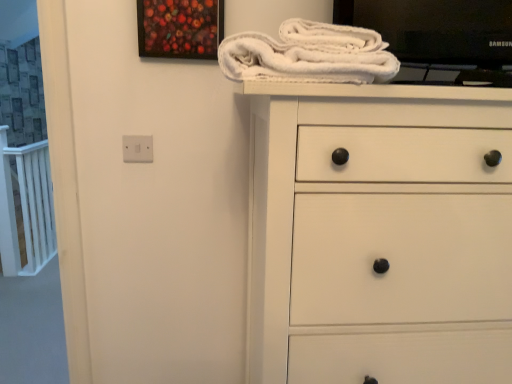
Question: Does white matte chest of drawers at center have a lesser width compared to painted wood picture frame at upper center?

Choices:
 (A) no
 (B) yes

Answer: (A)

Question: Is white matte chest of drawers at center wider than painted wood picture frame at upper center?

Choices:
 (A) no
 (B) yes

Answer: (B)

Question: Is white matte chest of drawers at center behind painted wood picture frame at upper center?

Choices:
 (A) yes
 (B) no

Answer: (B)

Question: Is white matte chest of drawers at center turned away from painted wood picture frame at upper center?

Choices:
 (A) no
 (B) yes

Answer: (A)

Question: Is white matte chest of drawers at center to the left of painted wood picture frame at upper center from the viewer's perspective?

Choices:
 (A) yes
 (B) no

Answer: (B)

Question: Is white matte chest of drawers at center taller or shorter than painted wood picture frame at upper center?

Choices:
 (A) short
 (B) tall

Answer: (B)

Question: In terms of size, does white matte chest of drawers at center appear bigger or smaller than painted wood picture frame at upper center?

Choices:
 (A) small
 (B) big

Answer: (B)

Question: From the image's perspective, is white matte chest of drawers at center above or below painted wood picture frame at upper center?

Choices:
 (A) above
 (B) below

Answer: (B)

Question: In the image, is white matte chest of drawers at center positioned in front of or behind painted wood picture frame at upper center?

Choices:
 (A) front
 (B) behind

Answer: (A)

Question: Is white matte chest of drawers at center situated inside white fluffy bath towel at upper center or outside?

Choices:
 (A) outside
 (B) inside

Answer: (A)

Question: From the image's perspective, is white matte chest of drawers at center located above or below white fluffy bath towel at upper center?

Choices:
 (A) above
 (B) below

Answer: (B)

Question: Considering the positions of white matte chest of drawers at center and white fluffy bath towel at upper center in the image, is white matte chest of drawers at center taller or shorter than white fluffy bath towel at upper center?

Choices:
 (A) short
 (B) tall

Answer: (B)

Question: In terms of width, does white matte chest of drawers at center look wider or thinner when compared to white fluffy bath towel at upper center?

Choices:
 (A) wide
 (B) thin

Answer: (A)

Question: Is white fluffy bath towel at upper center bigger or smaller than painted wood picture frame at upper center?

Choices:
 (A) small
 (B) big

Answer: (B)

Question: In the image, is white fluffy bath towel at upper center on the left side or the right side of painted wood picture frame at upper center?

Choices:
 (A) left
 (B) right

Answer: (B)